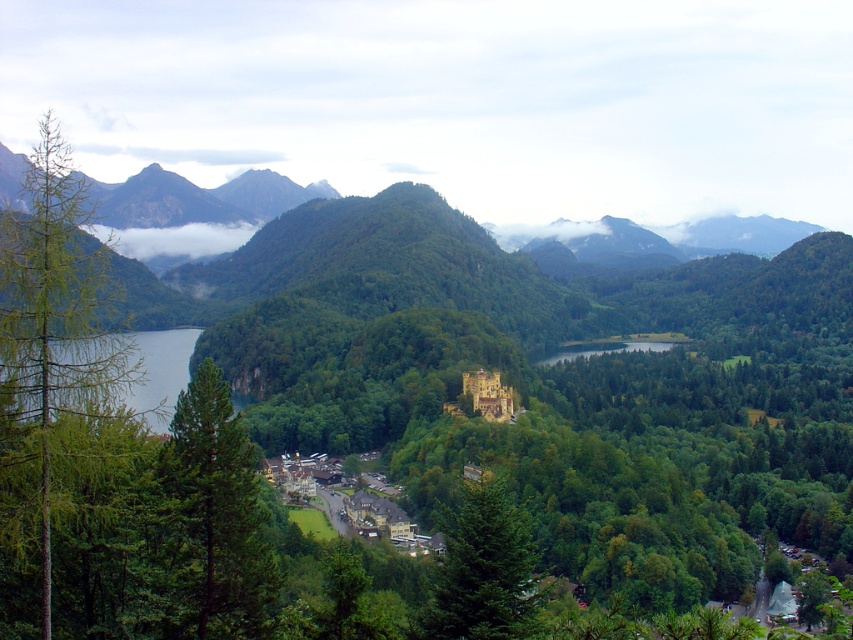
Question: Can you confirm if green needle-like tree at left is wider than green textured tree at center?

Choices:
 (A) yes
 (B) no

Answer: (A)

Question: Does brown wooden houses at center have a lesser width compared to shiny blue water at left?

Choices:
 (A) yes
 (B) no

Answer: (A)

Question: Which object is the closest to the brown wooden houses at center?

Choices:
 (A) green matte tree at left
 (B) shiny blue water at left
 (C) green textured tree at center
 (D) green needle-like tree at left

Answer: (A)

Question: Which object is closer to the camera taking this photo?

Choices:
 (A) brown wooden houses at center
 (B) shiny blue water at left
 (C) green needle-like tree at left
 (D) green textured tree at center

Answer: (C)

Question: Does green needle-like tree at left appear under green textured tree at center?

Choices:
 (A) yes
 (B) no

Answer: (B)

Question: Which of the following is the farthest from the observer?

Choices:
 (A) green matte tree at left
 (B) green needle-like tree at left
 (C) green textured tree at center
 (D) brown wooden houses at center

Answer: (D)